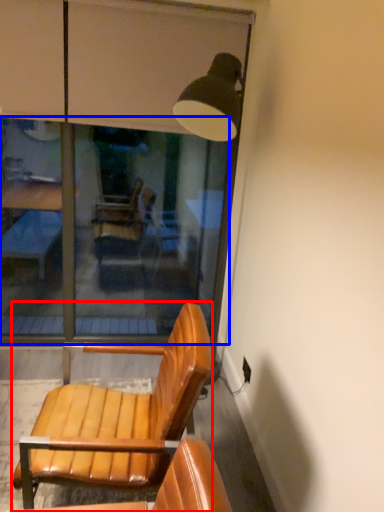
Question: Which object appears closest to the camera in this image, chair (highlighted by a red box) or glass window (highlighted by a blue box)?

Choices:
 (A) chair
 (B) glass window

Answer: (A)